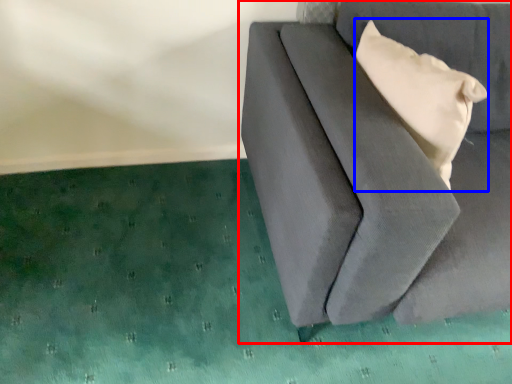
Question: Which object appears farthest to the camera in this image, furniture (highlighted by a red box) or pillow (highlighted by a blue box)?

Choices:
 (A) furniture
 (B) pillow

Answer: (B)